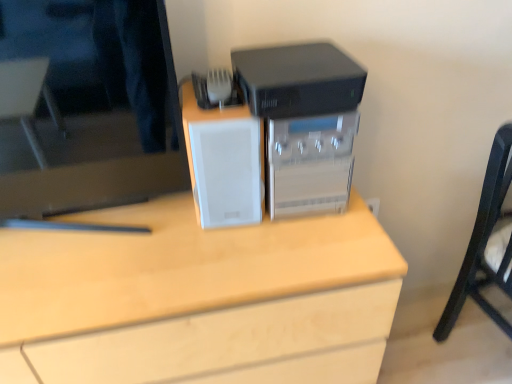
Question: In the image, is sleek plastic printer at center positioned in front of or behind matte black monitor at upper left?

Choices:
 (A) front
 (B) behind

Answer: (B)

Question: Is sleek plastic printer at center bigger or smaller than matte black monitor at upper left?

Choices:
 (A) small
 (B) big

Answer: (A)

Question: Considering the real-world distances, which object is farthest from the sleek plastic printer at center?

Choices:
 (A) white matte speaker at center
 (B) matte black monitor at upper left
 (C) white matte desk at center

Answer: (B)

Question: Which object is the farthest from the white matte speaker at center?

Choices:
 (A) white matte desk at center
 (B) matte black monitor at upper left
 (C) sleek plastic printer at center

Answer: (A)